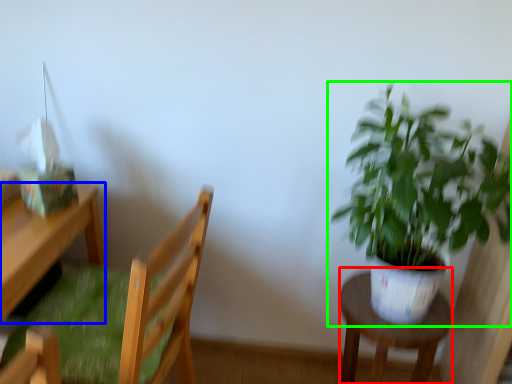
Question: Which object is the closest to the stool (highlighted by a red box)? Choose among these: desk (highlighted by a blue box) or houseplant (highlighted by a green box).

Choices:
 (A) desk
 (B) houseplant

Answer: (B)